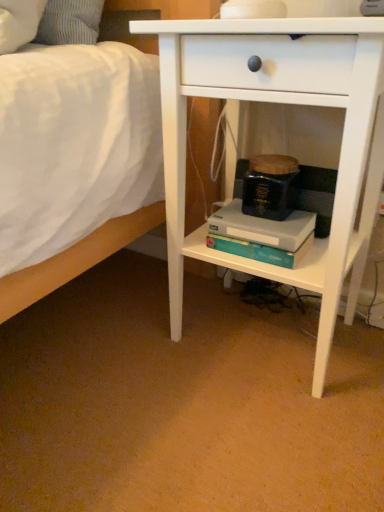
Measure the distance between teal matte paperback book at center, the second paperback book viewed from the top, and camera.

A distance of 32.81 inches exists between teal matte paperback book at center, the second paperback book viewed from the top, and camera.

Measure the distance between point (307, 228) and camera.

Point (307, 228) and camera are 34.29 inches apart from each other.

Identify the location of teal matte paperback book at center, which is counted as the first paperback book, starting from the bottom. (262, 227).

Considering the relative positions of teal matte paperback book at center, which is the 1th paperback book in top-to-bottom order, and white matte nightstand at center in the image provided, is teal matte paperback book at center, which is the 1th paperback book in top-to-bottom order, to the left or to the right of white matte nightstand at center?

teal matte paperback book at center, which is the 1th paperback book in top-to-bottom order, is to the left of white matte nightstand at center.

Is teal matte paperback book at center, which is counted as the 2th paperback book, starting from the bottom, shorter than white matte nightstand at center?

Yes, teal matte paperback book at center, which is counted as the 2th paperback book, starting from the bottom, is shorter than white matte nightstand at center.

Can you tell me how much teal matte paperback book at center, which is counted as the 2th paperback book, starting from the bottom, and white matte nightstand at center differ in facing direction?

0.354 degrees.

From the image's perspective, is teal matte paperback book at center, which is the 1th paperback book in top-to-bottom order, located above white matte nightstand at center?

Yes, from the image's perspective, teal matte paperback book at center, which is the 1th paperback book in top-to-bottom order, is on top of white matte nightstand at center.

Is white matte nightstand at center facing towards teal matte paperback book at center, which is counted as the 2th paperback book, starting from the bottom?

Yes, white matte nightstand at center is aimed at teal matte paperback book at center, which is counted as the 2th paperback book, starting from the bottom.

From a real-world perspective, who is located higher, white matte nightstand at center or teal matte paperback book at center, which is the 1th paperback book in top-to-bottom order?

teal matte paperback book at center, which is the 1th paperback book in top-to-bottom order.

Which object is closer to the camera, white matte nightstand at center or teal matte paperback book at center, which is the 1th paperback book in top-to-bottom order?

white matte nightstand at center is in front.

Does white matte nightstand at center contain teal matte paperback book at center, which is the 1th paperback book in top-to-bottom order?

Yes, white matte nightstand at center is surrounding teal matte paperback book at center, which is the 1th paperback book in top-to-bottom order.

From a real-world perspective, between teal matte paperback book at center, which is counted as the first paperback book, starting from the bottom, and white matte nightstand at center, who is vertically lower?

teal matte paperback book at center, which is counted as the first paperback book, starting from the bottom, is physically lower.

Could you tell me if teal matte paperback book at center, the second paperback book viewed from the top, is turned towards white matte nightstand at center?

Yes.

From their relative heights in the image, would you say teal matte paperback book at center, which is counted as the first paperback book, starting from the bottom, is taller or shorter than white matte nightstand at center?

In the image, teal matte paperback book at center, which is counted as the first paperback book, starting from the bottom, appears to be shorter than white matte nightstand at center.

Considering the positions of objects teal matte paperback book at center, which is counted as the first paperback book, starting from the bottom, and white matte nightstand at center in the image provided, who is behind, teal matte paperback book at center, which is counted as the first paperback book, starting from the bottom, or white matte nightstand at center?

teal matte paperback book at center, which is counted as the first paperback book, starting from the bottom.

Which object is thinner, teal matte paperback book at center, which is counted as the 2th paperback book, starting from the bottom, or teal matte paperback book at center, which is counted as the first paperback book, starting from the bottom?

teal matte paperback book at center, which is counted as the 2th paperback book, starting from the bottom, is thinner.

Between teal matte paperback book at center, which is the 1th paperback book in top-to-bottom order, and teal matte paperback book at center, the second paperback book viewed from the top, which one appears on the right side from the viewer's perspective?

From the viewer's perspective, teal matte paperback book at center, which is the 1th paperback book in top-to-bottom order, appears more on the right side.

Find the location of a particular element. Image resolution: width=384 pixels, height=512 pixels. paperback book that is below the teal matte paperback book at center, which is the 1th paperback book in top-to-bottom order (from the image's perspective) is located at coordinates (262, 227).

Which of these two, teal matte paperback book at center, which is counted as the 2th paperback book, starting from the bottom, or teal matte paperback book at center, which is counted as the first paperback book, starting from the bottom, stands taller?

teal matte paperback book at center, which is counted as the 2th paperback book, starting from the bottom, is taller.

Relative to teal matte paperback book at center, which is the 1th paperback book in top-to-bottom order, is teal matte paperback book at center, the second paperback book viewed from the top, in front or behind?

Visually, teal matte paperback book at center, the second paperback book viewed from the top, is located in front of teal matte paperback book at center, which is the 1th paperback book in top-to-bottom order.

Considering the positions of points (308, 221) and (243, 202), is point (308, 221) farther from camera compared to point (243, 202)?

No, (308, 221) is closer to viewer.

Is teal matte paperback book at center, which is the 1th paperback book in top-to-bottom order, at the back of teal matte paperback book at center, the second paperback book viewed from the top?

No, teal matte paperback book at center, the second paperback book viewed from the top, is not facing the opposite direction of teal matte paperback book at center, which is the 1th paperback book in top-to-bottom order.

From their relative heights in the image, would you say teal matte paperback book at center, which is counted as the first paperback book, starting from the bottom, is taller or shorter than teal matte paperback book at center, which is counted as the 2th paperback book, starting from the bottom?

teal matte paperback book at center, which is counted as the first paperback book, starting from the bottom, is shorter than teal matte paperback book at center, which is counted as the 2th paperback book, starting from the bottom.

In the scene shown: Which of these two, white matte nightstand at center or teal matte paperback book at center, which is counted as the first paperback book, starting from the bottom, is smaller?

With smaller size is teal matte paperback book at center, which is counted as the first paperback book, starting from the bottom.

Between white matte nightstand at center and teal matte paperback book at center, which is counted as the first paperback book, starting from the bottom, which one has more height?

white matte nightstand at center.

From a real-world perspective, is white matte nightstand at center located higher than teal matte paperback book at center, which is counted as the first paperback book, starting from the bottom?

Indeed, from a real-world perspective, white matte nightstand at center stands above teal matte paperback book at center, which is counted as the first paperback book, starting from the bottom.

Locate an element on the screen. nightstand that is below the teal matte paperback book at center, which is the 1th paperback book in top-to-bottom order (from the image's perspective) is located at coordinates (281, 103).

Where is `the 1st paperback book to the left of the white matte nightstand at center, starting your count from the anchor`? The image size is (384, 512). the 1st paperback book to the left of the white matte nightstand at center, starting your count from the anchor is located at coordinates (270, 194).

Based on their spatial positions, is white matte nightstand at center or teal matte paperback book at center, which is counted as the 2th paperback book, starting from the bottom, closer to teal matte paperback book at center, which is counted as the first paperback book, starting from the bottom?

teal matte paperback book at center, which is counted as the 2th paperback book, starting from the bottom, is closer to teal matte paperback book at center, which is counted as the first paperback book, starting from the bottom.

When comparing their distances from white matte nightstand at center, does teal matte paperback book at center, which is the 1th paperback book in top-to-bottom order, or teal matte paperback book at center, which is counted as the first paperback book, starting from the bottom, seem closer?

Based on the image, teal matte paperback book at center, which is counted as the first paperback book, starting from the bottom, appears to be nearer to white matte nightstand at center.

Considering their positions, is teal matte paperback book at center, the second paperback book viewed from the top, positioned closer to white matte nightstand at center than teal matte paperback book at center, which is the 1th paperback book in top-to-bottom order?

The object closer to white matte nightstand at center is teal matte paperback book at center, the second paperback book viewed from the top.

Based on their spatial positions, is white matte nightstand at center or teal matte paperback book at center, the second paperback book viewed from the top, closer to teal matte paperback book at center, which is counted as the 2th paperback book, starting from the bottom?

teal matte paperback book at center, the second paperback book viewed from the top, is closer to teal matte paperback book at center, which is counted as the 2th paperback book, starting from the bottom.

In the scene shown: Based on their spatial positions, is teal matte paperback book at center, which is the 1th paperback book in top-to-bottom order, or white matte nightstand at center closer to teal matte paperback book at center, the second paperback book viewed from the top?

The object closer to teal matte paperback book at center, the second paperback book viewed from the top, is teal matte paperback book at center, which is the 1th paperback book in top-to-bottom order.

Considering their positions, is teal matte paperback book at center, which is counted as the first paperback book, starting from the bottom, positioned further to teal matte paperback book at center, which is counted as the 2th paperback book, starting from the bottom, than white matte nightstand at center?

white matte nightstand at center lies further to teal matte paperback book at center, which is counted as the 2th paperback book, starting from the bottom, than the other object.

Find the location of a particular element. Image resolution: width=384 pixels, height=512 pixels. paperback book located between white matte nightstand at center and teal matte paperback book at center, which is counted as the 2th paperback book, starting from the bottom, in the depth direction is located at coordinates (262, 227).